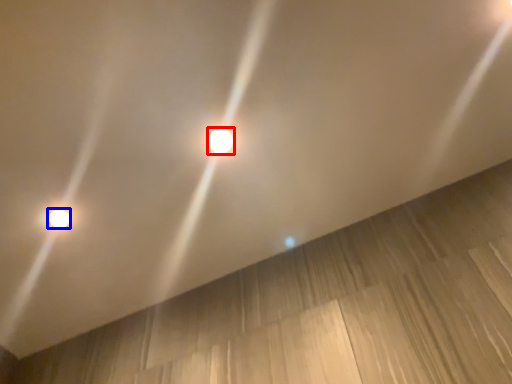
Question: Which object is closer to the camera taking this photo, lamp (highlighted by a red box) or lamp (highlighted by a blue box)?

Choices:
 (A) lamp
 (B) lamp

Answer: (A)